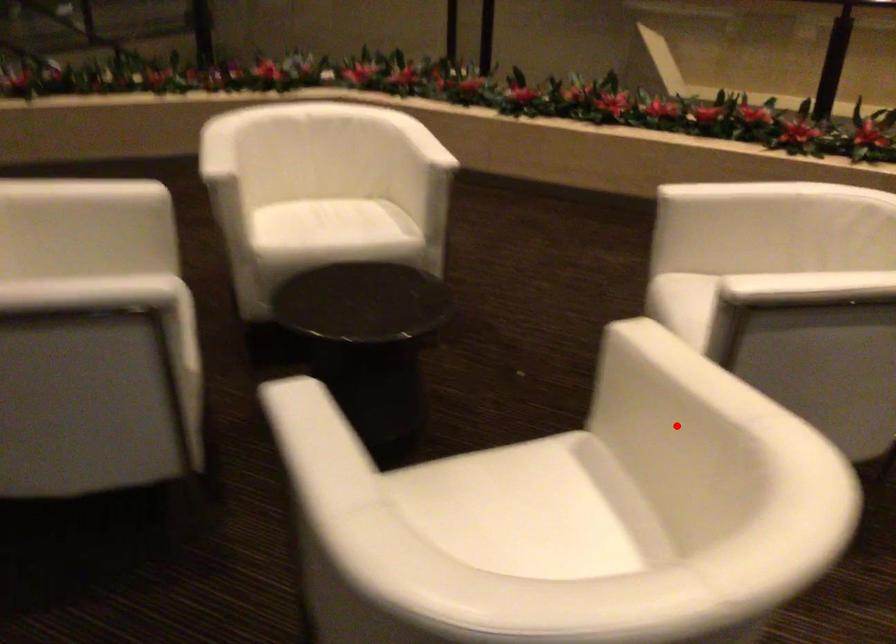
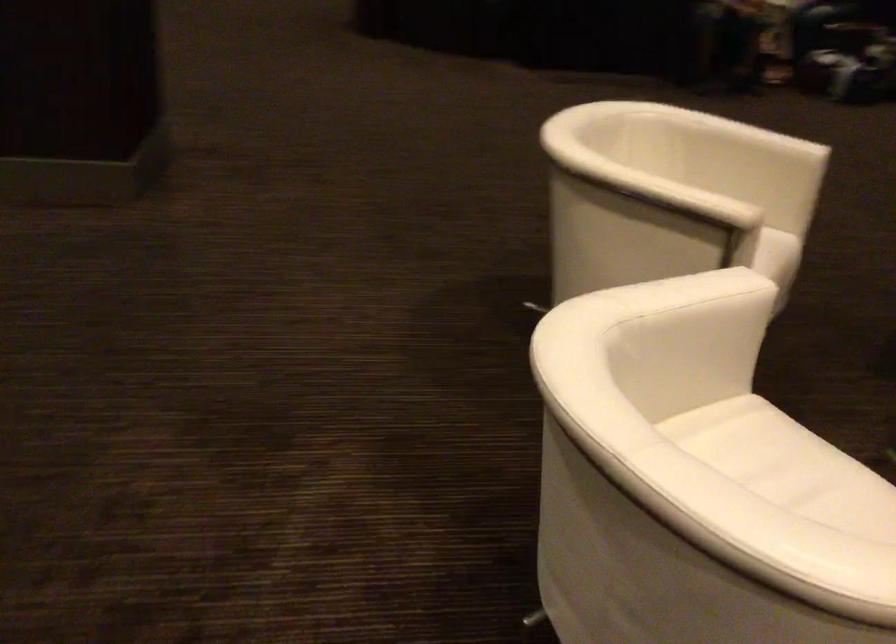
Question: I am providing you with two images of the same scene from different viewpoints. In image1, a red point is highlighted. Considering the same 3D point in image2, which of the following is correct?

Choices:
 (A) It is closer
 (B) It is farther

Answer: (B)